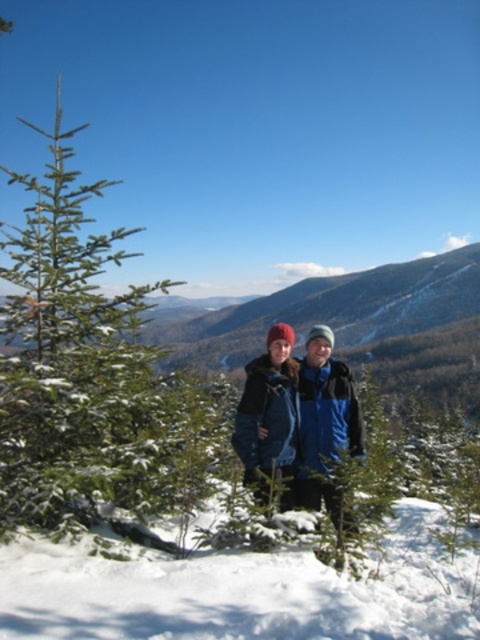
Which is more to the left, green textured pine tree at left or white snow at lower left?

From the viewer's perspective, green textured pine tree at left appears more on the left side.

The image size is (480, 640). What do you see at coordinates (88, 374) in the screenshot?
I see `green textured pine tree at left` at bounding box center [88, 374].

This screenshot has height=640, width=480. Find the location of `green textured pine tree at left`. green textured pine tree at left is located at coordinates (88, 374).

Is point (450, 579) positioned after point (237, 429)?

Yes, point (450, 579) is farther from viewer.

Based on the photo, between white snow at lower left and blue woolen jacket at center, which one has more height?

white snow at lower left is taller.

Describe the element at coordinates (241, 593) in the screenshot. The width and height of the screenshot is (480, 640). I see `white snow at lower left` at that location.

This screenshot has height=640, width=480. I want to click on white snow at lower left, so click(x=241, y=593).

Which is below, green textured pine tree at left or blue woolen jacket at center?

Positioned lower is green textured pine tree at left.

In the scene shown: Does green textured pine tree at left have a lesser width compared to blue woolen jacket at center?

No.

Image resolution: width=480 pixels, height=640 pixels. I want to click on green textured pine tree at left, so click(x=88, y=374).